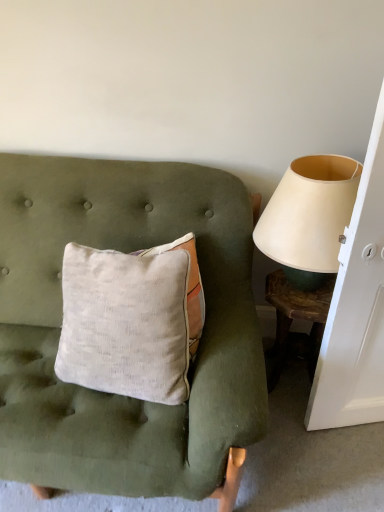
Question: Is textured linen pillow at center taller or shorter than wooden textured side table at right?

Choices:
 (A) short
 (B) tall

Answer: (B)

Question: Is point tap(225, 333) positioned closer to the camera than point tap(319, 314)?

Choices:
 (A) closer
 (B) farther

Answer: (A)

Question: Estimate the real-world distances between objects in this image. Which object is farther from the textured linen pillow at center?

Choices:
 (A) beige fabric lampshade at right
 (B) wooden textured side table at right

Answer: (B)

Question: Estimate the real-world distances between objects in this image. Which object is farther from the beige fabric lampshade at right?

Choices:
 (A) textured linen pillow at center
 (B) wooden textured side table at right

Answer: (A)